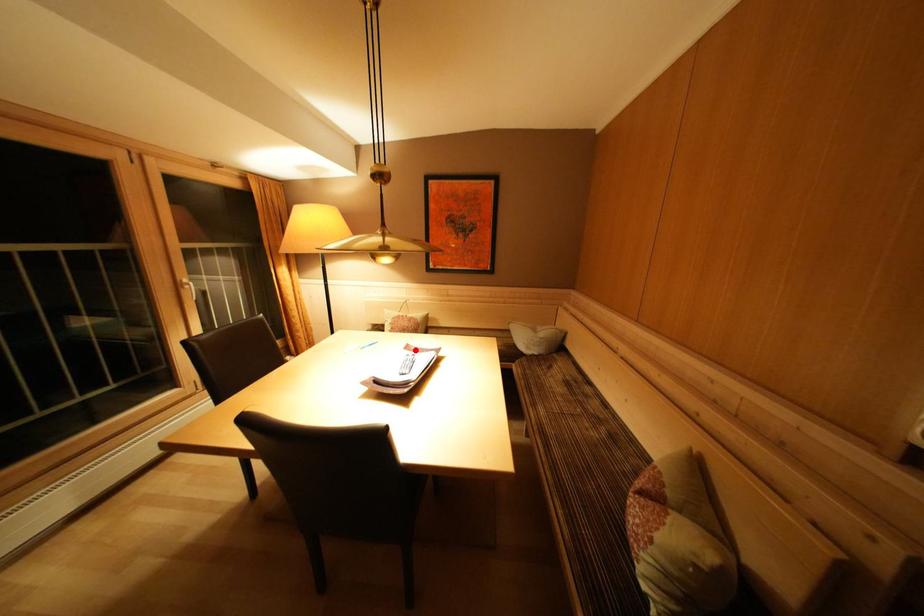
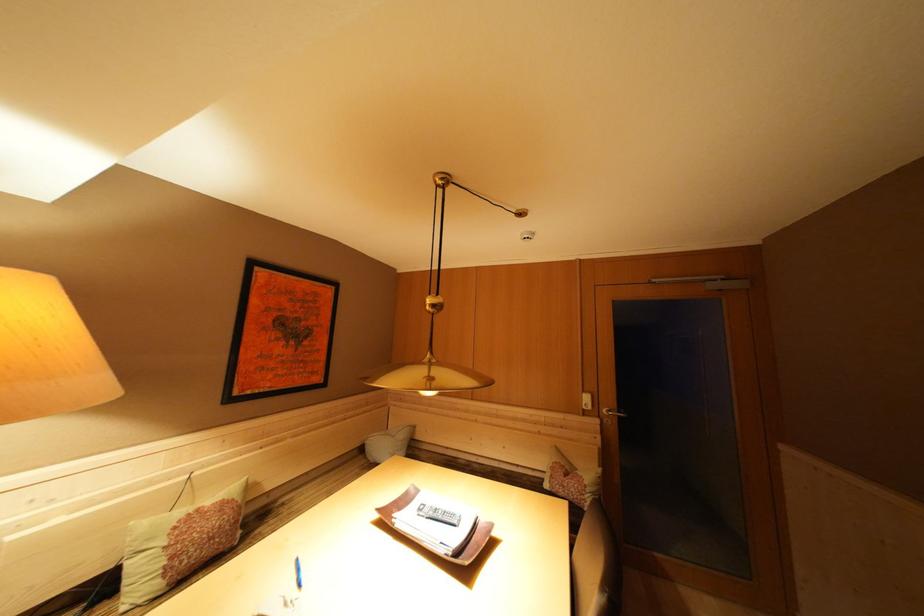
Question: A red point is marked in image1. In image2, is the corresponding 3D point closer to the camera or farther? Reply with the corresponding letter.

Choices:
 (A) The corresponding 3D point is closer.
 (B) The corresponding 3D point is farther.

Answer: (B)